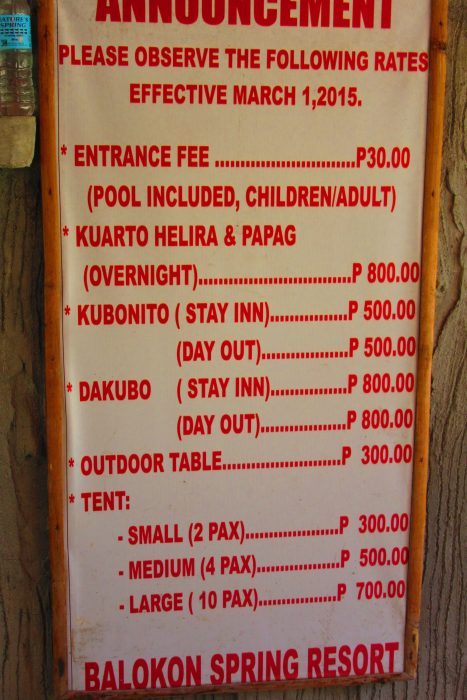
Identify the location of wood wall. Image resolution: width=467 pixels, height=700 pixels. (443, 594).